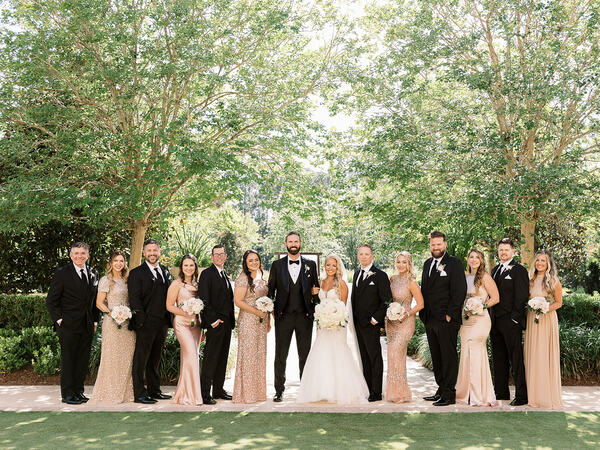
Locate an element on the screen. The width and height of the screenshot is (600, 450). bouquets is located at coordinates (541, 301), (474, 305), (394, 309), (331, 307), (263, 309), (190, 312), (118, 317).